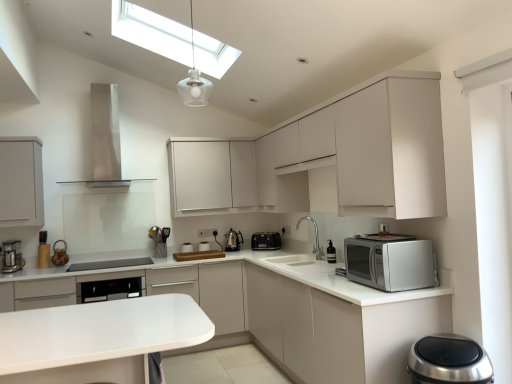
The image size is (512, 384). Identify the location of white glass pendant light at upper center. (194, 81).

The width and height of the screenshot is (512, 384). Describe the element at coordinates (266, 241) in the screenshot. I see `silver metallic microwave oven at center` at that location.

How much space does white matte cabinet at right, positioned as the 1th cabinetry in right-to-left order, occupy vertically?

The height of white matte cabinet at right, positioned as the 1th cabinetry in right-to-left order, is 3.34 feet.

Where is `matte white cabinet at left, arranged as the first cabinetry when viewed from the left`? Image resolution: width=512 pixels, height=384 pixels. matte white cabinet at left, arranged as the first cabinetry when viewed from the left is located at coordinates (21, 182).

Describe the element at coordinates (280, 311) in the screenshot. I see `white glossy countertop at right, arranged as the second countertop when viewed from the back` at that location.

Locate an element on the screen. Image resolution: width=512 pixels, height=384 pixels. white glass pendant light at upper center is located at coordinates (194, 81).

Can you tell me how much silver metallic microwave oven at center and matte white cabinet at left, placed as the 4th cabinetry when sorted from right to left, differ in facing direction?

The facing directions of silver metallic microwave oven at center and matte white cabinet at left, placed as the 4th cabinetry when sorted from right to left, are 42.3 degrees apart.

In terms of height, does silver metallic microwave oven at center look taller or shorter compared to matte white cabinet at left, placed as the 4th cabinetry when sorted from right to left?

Considering their sizes, silver metallic microwave oven at center has less height than matte white cabinet at left, placed as the 4th cabinetry when sorted from right to left.

At what (x,y) coordinates should I click in order to perform the action: click on cabinetry that is the 3rd one above the silver metallic microwave oven at center (from a real-world perspective). Please return your answer as a coordinate pair (x, y). This screenshot has width=512, height=384. Looking at the image, I should click on (21, 182).

Does point (279, 242) appear closer or farther from the camera than point (8, 143)?

Point (279, 242) is positioned farther from the camera compared to point (8, 143).

How distant is white glossy countertop at lower center, which appears as the 2th countertop when viewed from the front, from white glass pendant light at upper center?

white glossy countertop at lower center, which appears as the 2th countertop when viewed from the front, and white glass pendant light at upper center are 2.78 meters apart from each other.

From a real-world perspective, is white glossy countertop at lower center, the 1th countertop from the back, above or below white glass pendant light at upper center?

From a real-world perspective, white glossy countertop at lower center, the 1th countertop from the back, is physically below white glass pendant light at upper center.

Which object is further away from the camera taking this photo, white glossy countertop at lower center, which appears as the 2th countertop when viewed from the front, or white glass pendant light at upper center?

Positioned behind is white glass pendant light at upper center.

From the image's perspective, is white glossy countertop at lower center, the 1th countertop from the back, located above or below white glass pendant light at upper center?

Based on their image positions, white glossy countertop at lower center, the 1th countertop from the back, is located beneath white glass pendant light at upper center.

Is metallic silver coffee maker at left in front of or behind white glass pendant light at upper center in the image?

metallic silver coffee maker at left is positioned farther from the viewer than white glass pendant light at upper center.

Is metallic silver coffee maker at left looking in the opposite direction of white glass pendant light at upper center?

No, metallic silver coffee maker at left's orientation is not away from white glass pendant light at upper center.

Is metallic silver coffee maker at left touching white glass pendant light at upper center?

metallic silver coffee maker at left and white glass pendant light at upper center are not in contact.

What are the coordinates of `kitchen appliance behind the white glass pendant light at upper center` in the screenshot? It's located at (11, 257).

Is metallic silver utensil holder at center, which is counted as the third appliance, starting from the front, facing towards white glass pendant light at upper center?

No, metallic silver utensil holder at center, which is counted as the third appliance, starting from the front, is not aimed at white glass pendant light at upper center.

This screenshot has height=384, width=512. In order to click on light fixture that appears on the right of metallic silver utensil holder at center, which is counted as the third appliance, starting from the front in this screenshot , I will do `click(194, 81)`.

Does metallic silver utensil holder at center, the 4th appliance in the right-to-left sequence, have a greater width compared to white glass pendant light at upper center?

Correct, the width of metallic silver utensil holder at center, the 4th appliance in the right-to-left sequence, exceeds that of white glass pendant light at upper center.

From the image's perspective, is white glossy countertop at right, the first countertop viewed from the front, located beneath matte white cabinet at left, placed as the 4th cabinetry when sorted from right to left?

Indeed, from the image's perspective, white glossy countertop at right, the first countertop viewed from the front, is shown beneath matte white cabinet at left, placed as the 4th cabinetry when sorted from right to left.

Would you say white glossy countertop at right, the first countertop viewed from the front, is outside matte white cabinet at left, placed as the 4th cabinetry when sorted from right to left?

Yes, white glossy countertop at right, the first countertop viewed from the front, is outside of matte white cabinet at left, placed as the 4th cabinetry when sorted from right to left.

Which is more to the right, white glossy countertop at right, arranged as the second countertop when viewed from the back, or matte white cabinet at left, arranged as the first cabinetry when viewed from the left?

white glossy countertop at right, arranged as the second countertop when viewed from the back.

From the picture: Considering the positions of objects white glossy countertop at right, arranged as the second countertop when viewed from the back, and matte white cabinet at left, arranged as the first cabinetry when viewed from the left, in the image provided, who is in front, white glossy countertop at right, arranged as the second countertop when viewed from the back, or matte white cabinet at left, arranged as the first cabinetry when viewed from the left,?

Positioned in front is white glossy countertop at right, arranged as the second countertop when viewed from the back.

Considering the points (283, 316) and (231, 251), which point is in front, point (283, 316) or point (231, 251)?

Positioned in front is point (283, 316).

Is white matte cabinet at right, positioned as the 1th cabinetry in right-to-left order, shorter than metallic silver kettle at center, the 2th appliance when ordered from right to left?

No, white matte cabinet at right, positioned as the 1th cabinetry in right-to-left order, is not shorter than metallic silver kettle at center, the 2th appliance when ordered from right to left.

Looking at this image, are white matte cabinet at right, positioned as the 1th cabinetry in right-to-left order, and metallic silver kettle at center, which appears as the fourth appliance when viewed from the left, beside each other?

No, white matte cabinet at right, positioned as the 1th cabinetry in right-to-left order, is not with metallic silver kettle at center, which appears as the fourth appliance when viewed from the left.

How much distance is there between silver metallic microwave oven at center and white matte cabinet at right, arranged as the 4th cabinetry when viewed from the left?

The distance of silver metallic microwave oven at center from white matte cabinet at right, arranged as the 4th cabinetry when viewed from the left, is 5.92 feet.

Choose the correct answer: Is silver metallic microwave oven at center inside white matte cabinet at right, positioned as the 1th cabinetry in right-to-left order, or outside it?

silver metallic microwave oven at center exists entirely within white matte cabinet at right, positioned as the 1th cabinetry in right-to-left order.

Find the location of `microwave oven above the white matte cabinet at right, positioned as the 1th cabinetry in right-to-left order (from the image's perspective)`. microwave oven above the white matte cabinet at right, positioned as the 1th cabinetry in right-to-left order (from the image's perspective) is located at coordinates (266, 241).

Which is behind, silver metallic microwave oven at center or white matte cabinet at right, arranged as the 4th cabinetry when viewed from the left?

Positioned behind is silver metallic microwave oven at center.

You are a GUI agent. You are given a task and a screenshot of the screen. Output one action in this format:
    pyautogui.click(x=<x>, y=<y>)
    Task: Click on the microwave oven behind the matte white cabinet at left, arranged as the first cabinetry when viewed from the left
    
    Given the screenshot: What is the action you would take?
    pyautogui.click(x=266, y=241)

From a real-world perspective, which countertop is the 1st one underneath the white glass pendant light at upper center? Please provide its 2D coordinates.

[(97, 339)]

Which object lies further to the anchor point satin black oven at lower center, metallic silver coffee maker at left or wooden bowl at left, which appears as the fourth appliance when viewed from the back?

metallic silver coffee maker at left.

From the image, which object appears to be nearer to metallic silver kettle at center, positioned as the first appliance in back-to-front order, metallic silver coffee maker at left or white matte cabinet at upper center, the 2th cabinetry when ordered from right to left?

The object closer to metallic silver kettle at center, positioned as the first appliance in back-to-front order, is white matte cabinet at upper center, the 2th cabinetry when ordered from right to left.

From the image, which object appears to be nearer to satin black oven at lower center, white glossy countertop at lower center, the 1th countertop from the back, or white matte cabinet at right, arranged as the 4th cabinetry when viewed from the left?

white matte cabinet at right, arranged as the 4th cabinetry when viewed from the left, lies closer to satin black oven at lower center than the other object.

When comparing their distances from white matte cabinet at right, positioned as the 1th cabinetry in right-to-left order, does transparent glass skylight at upper center or satin black oven at lower center seem further?

transparent glass skylight at upper center is positioned further to the anchor white matte cabinet at right, positioned as the 1th cabinetry in right-to-left order.

Estimate the real-world distances between objects in this image. Which object is closer to metallic silver coffee maker at left, white glossy countertop at right, the first countertop viewed from the front, or stainless steel range hood at upper center, arranged as the first home appliance when viewed from the back?

Based on the image, stainless steel range hood at upper center, arranged as the first home appliance when viewed from the back, appears to be nearer to metallic silver coffee maker at left.

Looking at the image, which one is located closer to white matte cabinet at upper center, the 2th cabinetry when ordered from right to left, metallic silver kettle at center, positioned as the first appliance in back-to-front order, or transparent glass skylight at upper center?

Based on the image, transparent glass skylight at upper center appears to be nearer to white matte cabinet at upper center, the 2th cabinetry when ordered from right to left.

Considering their positions, is metallic silver coffee maker at left positioned further to silver metallic microwave oven at center than white glossy countertop at lower center, the 1th countertop from the back?

white glossy countertop at lower center, the 1th countertop from the back.

Looking at the image, which one is located further to satin black oven at lower center, wooden bowl at left, the fifth appliance when ordered from right to left, or metallic silver utensil holder at center, which is the 2th appliance in left-to-right order?

wooden bowl at left, the fifth appliance when ordered from right to left, is further to satin black oven at lower center.

Locate an element on the screen. microwave oven between wooden bowl at left, positioned as the second appliance in front-to-back order, and silver metallic faucet at center, in the horizontal direction is located at coordinates (266, 241).

Where is `lighting between white glossy countertop at lower center, which appears as the 2th countertop when viewed from the front, and metallic silver utensil holder at center, which is the 2th appliance in left-to-right order, in the front-back direction`? The width and height of the screenshot is (512, 384). lighting between white glossy countertop at lower center, which appears as the 2th countertop when viewed from the front, and metallic silver utensil holder at center, which is the 2th appliance in left-to-right order, in the front-back direction is located at coordinates (170, 39).

In order to click on light fixture positioned between silver metallic microwave at right, the 2th home appliance in the back-to-front sequence, and white matte cabinet at upper center, the 3th cabinetry in the right-to-left sequence, from near to far in this screenshot , I will do `click(194, 81)`.

The image size is (512, 384). Find the location of `oven located between satin silver trash can at lower right, positioned as the fifth appliance in back-to-front order, and white matte toaster at center, which is the second appliance from back to front, in the depth direction`. oven located between satin silver trash can at lower right, positioned as the fifth appliance in back-to-front order, and white matte toaster at center, which is the second appliance from back to front, in the depth direction is located at coordinates (109, 289).